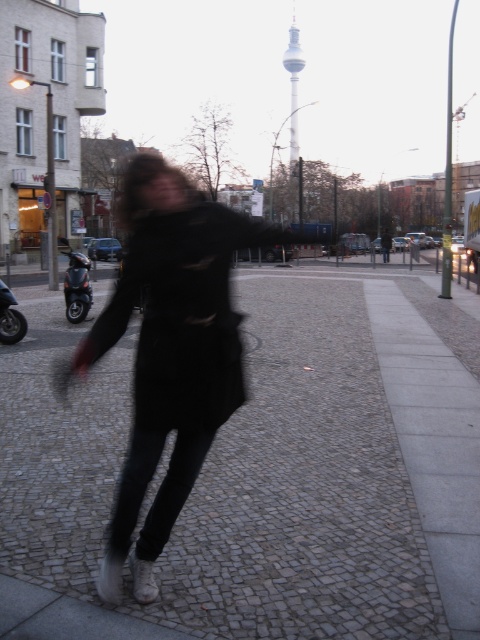
In the scene shown: Measure the distance between point [156,224] and camera.

Point [156,224] is 2.65 meters from camera.

I want to click on ripped black coat at center, so click(169, 349).

Is cobblestone pavement at center to the right of ripped black coat at center from the viewer's perspective?

Incorrect, cobblestone pavement at center is not on the right side of ripped black coat at center.

Between cobblestone pavement at center and ripped black coat at center, which one has less height?

cobblestone pavement at center is shorter.

Locate an element on the screen. The image size is (480, 640). cobblestone pavement at center is located at coordinates (264, 472).

Consider the image. Is the position of cobblestone pavement at center less distant than that of brushed metal scooter at left?

Yes, it is in front of brushed metal scooter at left.

Who is taller, cobblestone pavement at center or brushed metal scooter at left?

brushed metal scooter at left

Who is more forward, (211, 465) or (84, 268)?

Positioned in front is point (211, 465).

Find the location of a particular element. This screenshot has height=640, width=480. cobblestone pavement at center is located at coordinates (264, 472).